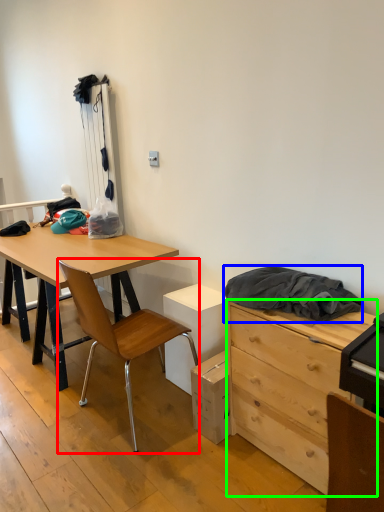
Question: Considering the real-world distances, which object is closest to chair (highlighted by a red box)? clothing (highlighted by a blue box) or chest of drawers (highlighted by a green box).

Choices:
 (A) clothing
 (B) chest of drawers

Answer: (B)